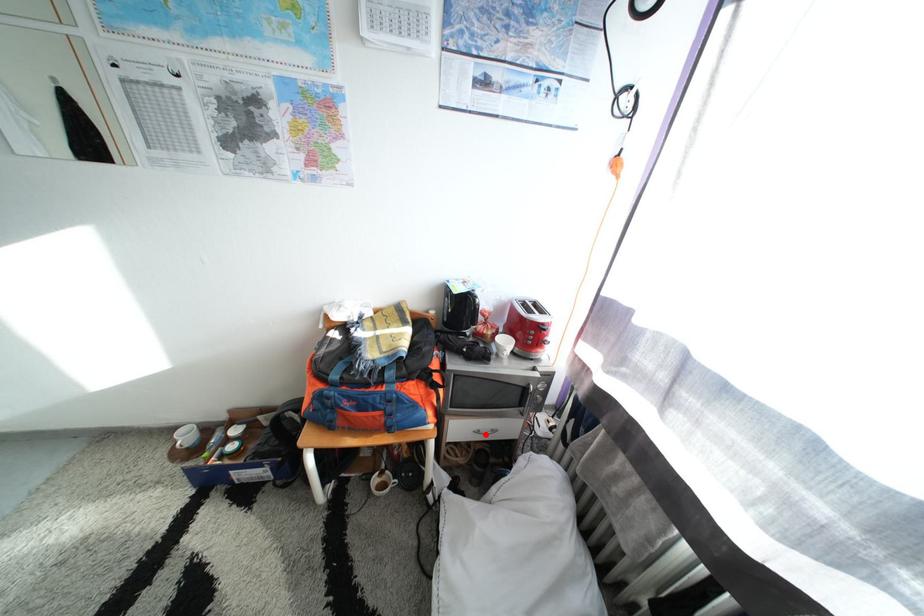
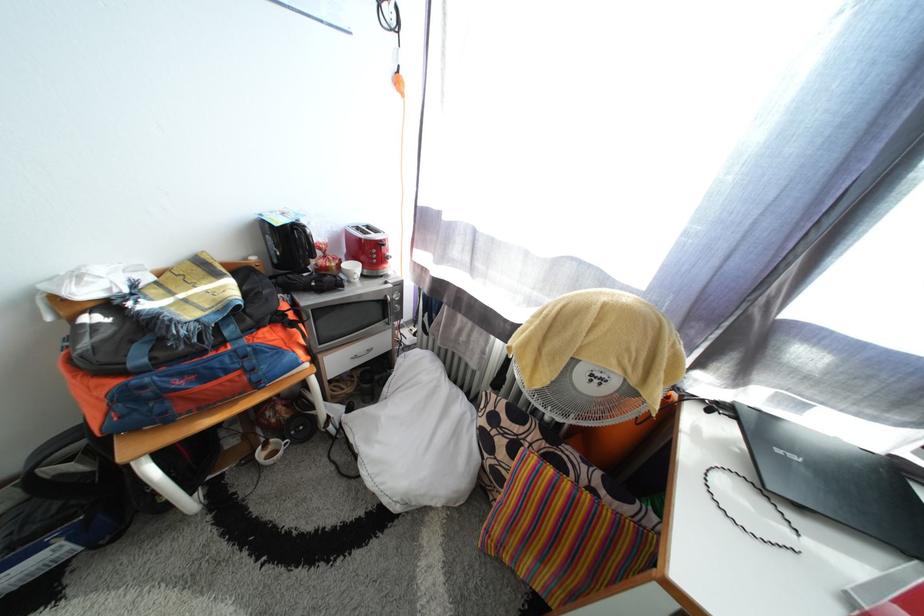
The point at the highlighted location is marked in the first image. Where is the corresponding point in the second image?

(361, 361)